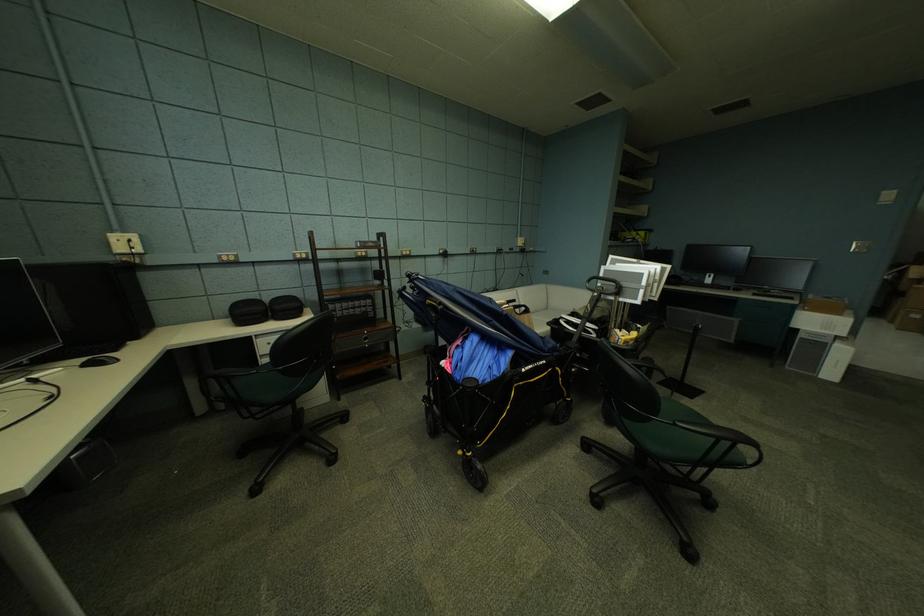
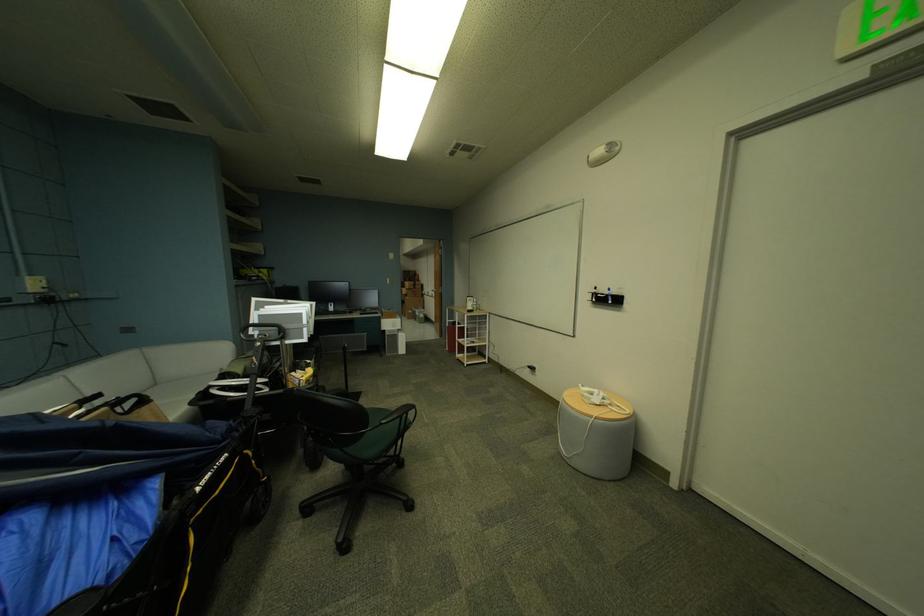
Locate, in the second image, the point that corresponds to [555,310] in the first image.

(164, 386)